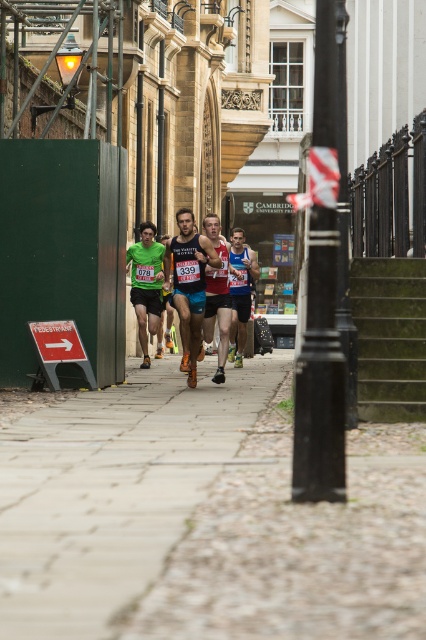
You are a runner in the marathon and you need to get to the water station ahead. You see the concrete paving at center and the green metal stairs at center. Which one should you avoid stepping on to stay on the correct path?

You should avoid stepping on the green metal stairs at center because the concrete paving at center is positioned under it, meaning the stairs are above and not part of the running path.